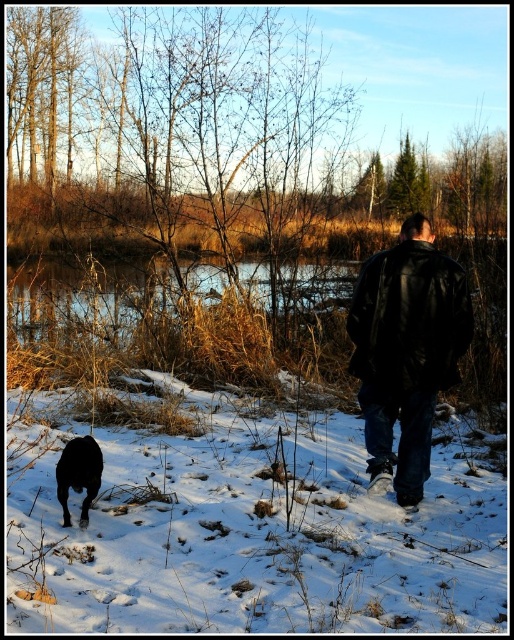
Which is behind, point (374, 259) or point (120, 328)?

Point (120, 328)

Looking at this image, does black leather jacket at center have a larger size compared to brown grassy creek at center?

No, black leather jacket at center is not bigger than brown grassy creek at center.

Which is in front, point (372, 394) or point (8, 316)?

Point (372, 394)

Where is `black leather jacket at center`? black leather jacket at center is located at coordinates pyautogui.click(x=407, y=349).

In the scene shown: Between white fluffy snow at lower center and shiny black dog at lower left, which one has more height?

With more height is white fluffy snow at lower center.

Does white fluffy snow at lower center appear over shiny black dog at lower left?

No.

Does point (323, 573) come behind point (81, 490)?

No, it is not.

Where is `white fluffy snow at lower center`? white fluffy snow at lower center is located at coordinates (255, 534).

Which is more to the right, black leather jacket at center or shiny black dog at lower left?

black leather jacket at center is more to the right.

Is the position of black leather jacket at center less distant than that of shiny black dog at lower left?

No, it is not.

Measure the distance between point (399, 387) and camera.

Point (399, 387) and camera are 16.79 feet apart.

Identify the location of black leather jacket at center. Image resolution: width=514 pixels, height=640 pixels. (407, 349).